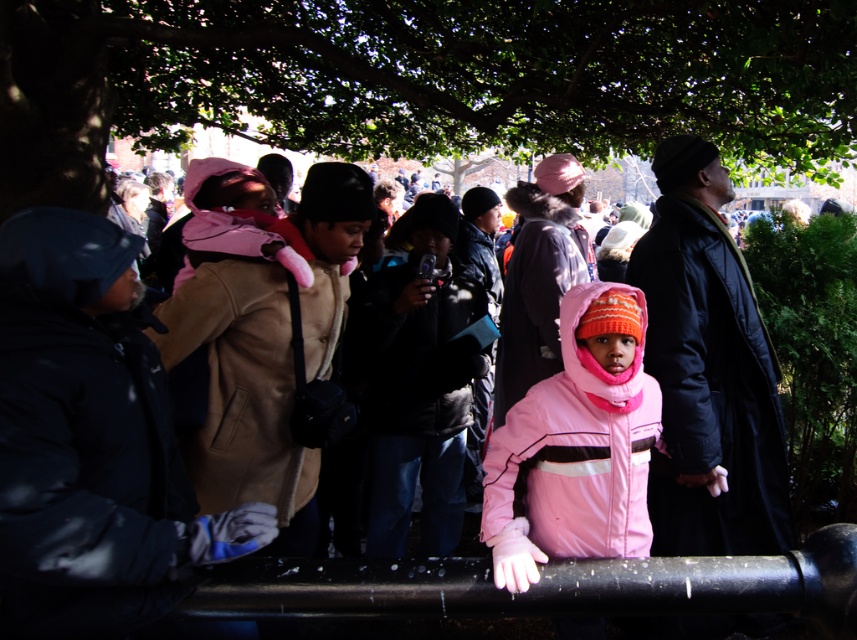
Question: Is pink fleece jacket at center closer to camera compared to matte pink coat at center?

Choices:
 (A) yes
 (B) no

Answer: (A)

Question: Is tan leather jacket at center closer to the viewer compared to matte pink coat at center?

Choices:
 (A) yes
 (B) no

Answer: (A)

Question: Which of the following is the farthest from the observer?

Choices:
 (A) tan leather jacket at center
 (B) matte pink coat at center
 (C) pink fleece jacket at center

Answer: (B)

Question: Does pink fleece jacket at center appear under pink matte jacket at center?

Choices:
 (A) yes
 (B) no

Answer: (B)

Question: Which object is the closest to the pink matte jacket at center?

Choices:
 (A) matte pink coat at center
 (B) dark brown leather jacket at center
 (C) tan leather jacket at center

Answer: (B)

Question: Which object is the closest to the tan leather jacket at center?

Choices:
 (A) pink fleece jacket at center
 (B) dark brown leather jacket at center
 (C) green leafy tree at upper center
 (D) matte pink coat at center

Answer: (B)